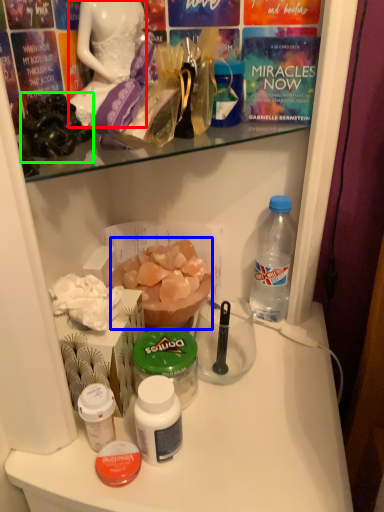
Question: Which object is positioned closest to fancy dress (highlighted by a red box)? Select from food (highlighted by a blue box) and stuff (highlighted by a green box).

Choices:
 (A) food
 (B) stuff

Answer: (B)